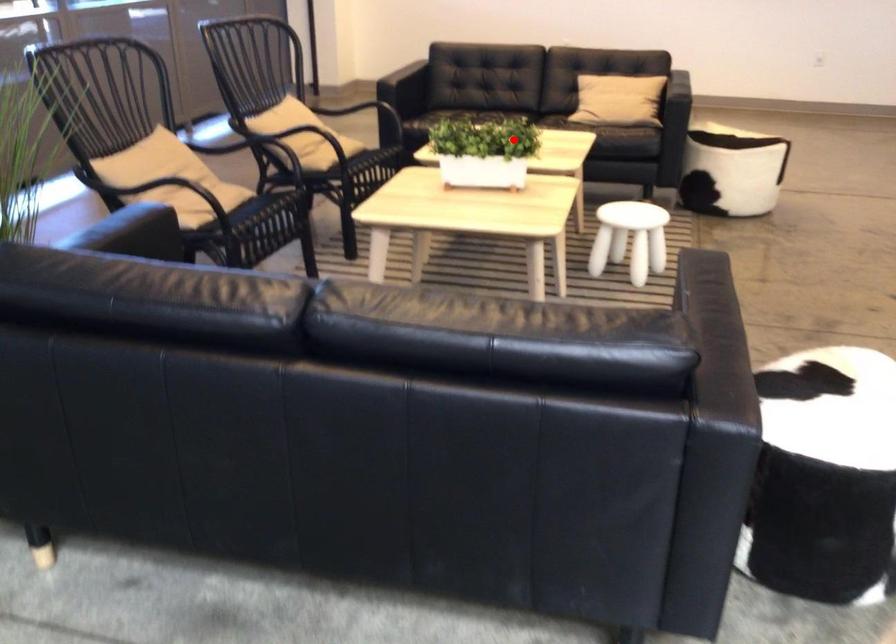
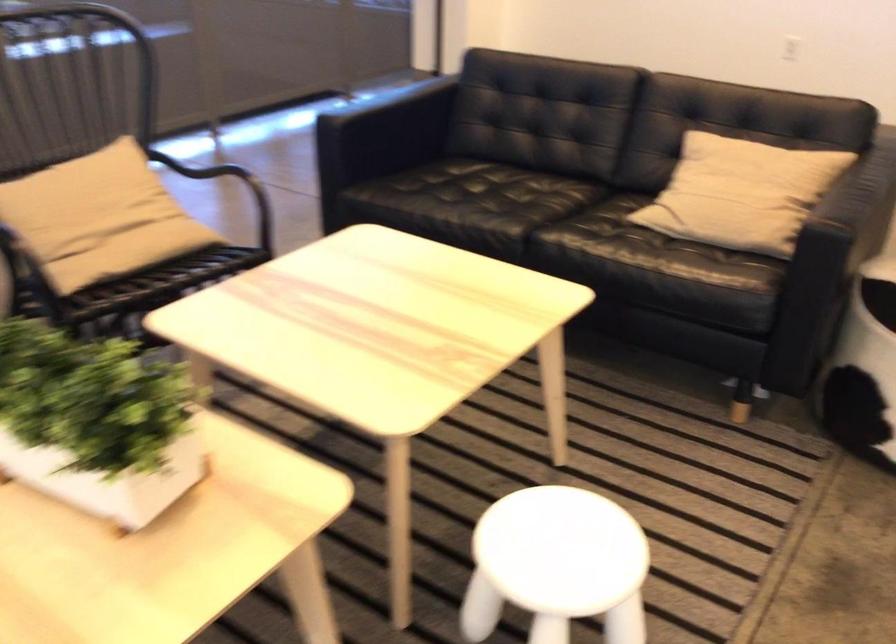
Locate, in the second image, the point that corresponds to the highlighted location in the first image.

(96, 422)